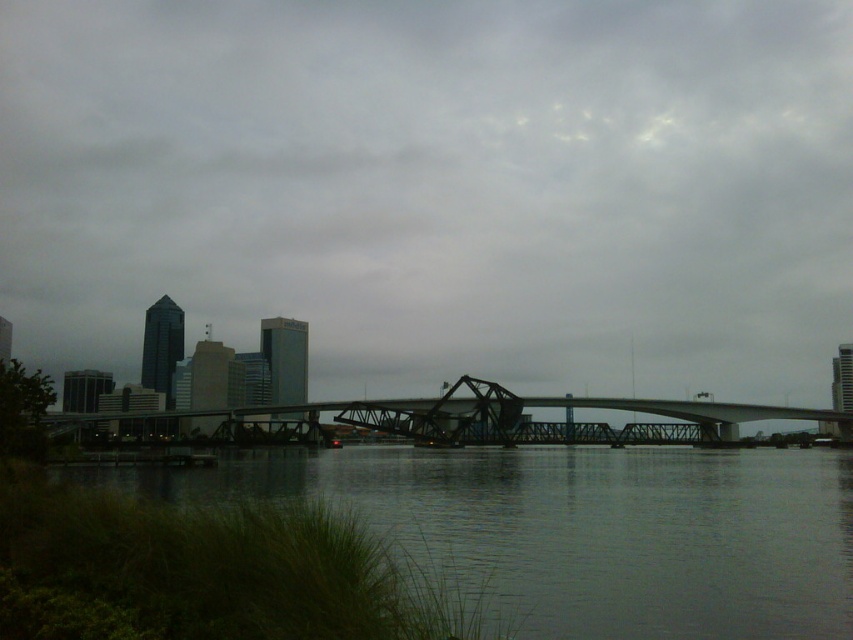
Question: Is matte gray bridge at center smaller than dark water at lower left?

Choices:
 (A) yes
 (B) no

Answer: (B)

Question: Among these objects, which one is farthest from the camera?

Choices:
 (A) steel bridge at center
 (B) dark water at lower left
 (C) matte gray bridge at center

Answer: (C)

Question: Does dark water at lower left have a greater width compared to steel bridge at center?

Choices:
 (A) yes
 (B) no

Answer: (B)

Question: Which object is the closest to the dark water at lower left?

Choices:
 (A) matte gray bridge at center
 (B) steel bridge at center

Answer: (B)

Question: Which object is the closest to the dark water at lower left?

Choices:
 (A) steel bridge at center
 (B) matte gray bridge at center

Answer: (A)

Question: Can you confirm if dark water at lower left is positioned to the right of steel bridge at center?

Choices:
 (A) no
 (B) yes

Answer: (B)